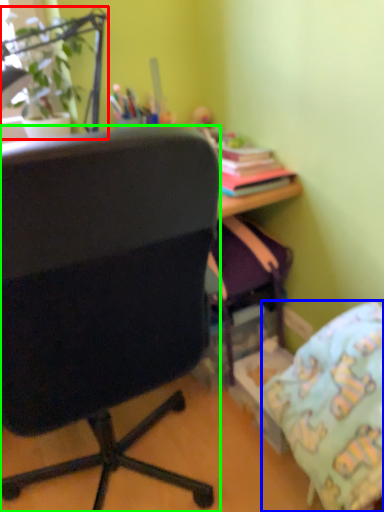
Question: Which is nearer to the houseplant (highlighted by a red box)? pillow (highlighted by a blue box) or chair (highlighted by a green box).

Choices:
 (A) pillow
 (B) chair

Answer: (B)